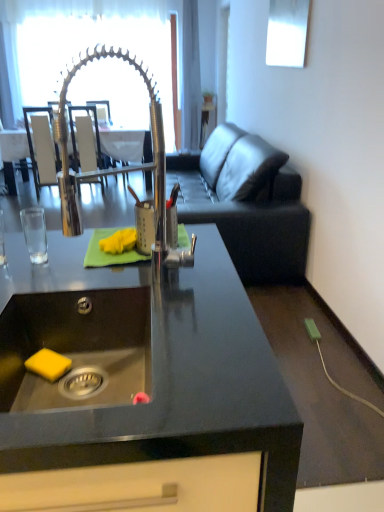
Locate an element on the screen. The image size is (384, 512). black granite countertop at center is located at coordinates (146, 374).

The width and height of the screenshot is (384, 512). In order to click on clear glass door at upper center in this screenshot , I will do `click(88, 42)`.

Describe the element at coordinates (246, 204) in the screenshot. The image size is (384, 512). I see `dark gray leather couch at right` at that location.

I want to click on black granite countertop at center, so click(146, 374).

Does wooden armchair at center, acting as the 2th armchair starting from the left, contain white leather armchair at upper left, which is the 2th armchair in right-to-left order?

No, wooden armchair at center, acting as the 2th armchair starting from the left, does not contain white leather armchair at upper left, which is the 2th armchair in right-to-left order.

Is point (89, 160) positioned before point (43, 147)?

Yes, point (89, 160) is in front of point (43, 147).

Is there a large distance between wooden armchair at center, acting as the 2th armchair starting from the left, and white leather armchair at upper left, the 1th armchair viewed from the left?

That's not correct — wooden armchair at center, acting as the 2th armchair starting from the left, is a little close to white leather armchair at upper left, the 1th armchair viewed from the left.

From their relative heights in the image, would you say wooden armchair at center, acting as the 2th armchair starting from the left, is taller or shorter than white leather armchair at upper left, the 1th armchair viewed from the left?

In the image, wooden armchair at center, acting as the 2th armchair starting from the left, appears to be shorter than white leather armchair at upper left, the 1th armchair viewed from the left.

From the image's perspective, starting from the stainless steel sink at lower left, which armchair is the 1st one above? Please provide its 2D coordinates.

[(42, 147)]

Is stainless steel sink at lower left directly adjacent to white leather armchair at upper left, which is the 2th armchair in right-to-left order?

stainless steel sink at lower left and white leather armchair at upper left, which is the 2th armchair in right-to-left order, are clearly separated.

From a real-world perspective, between stainless steel sink at lower left and white leather armchair at upper left, which is the 2th armchair in right-to-left order, who is vertically higher?

stainless steel sink at lower left is physically above.

Choose the correct answer: Is stainless steel sink at lower left inside white leather armchair at upper left, which is the 2th armchair in right-to-left order, or outside it?

stainless steel sink at lower left is located beyond the bounds of white leather armchair at upper left, which is the 2th armchair in right-to-left order.

Is polished chrome tap at center far away from clear glass door at upper center?

Indeed, polished chrome tap at center is not near clear glass door at upper center.

Between polished chrome tap at center and clear glass door at upper center, which one is positioned in front?

polished chrome tap at center is closer to the camera.

Is polished chrome tap at center positioned with its back to clear glass door at upper center?

polished chrome tap at center does not have its back to clear glass door at upper center.

Could you tell me if white leather armchair at upper left, which is the 2th armchair in right-to-left order, is turned towards wooden armchair at center, acting as the 2th armchair starting from the left?

No, white leather armchair at upper left, which is the 2th armchair in right-to-left order, is not facing towards wooden armchair at center, acting as the 2th armchair starting from the left.

Is white leather armchair at upper left, which is the 2th armchair in right-to-left order, to the left of wooden armchair at center, acting as the 2th armchair starting from the left, from the viewer's perspective?

Indeed, white leather armchair at upper left, which is the 2th armchair in right-to-left order, is positioned on the left side of wooden armchair at center, acting as the 2th armchair starting from the left.

Between white leather armchair at upper left, which is the 2th armchair in right-to-left order, and wooden armchair at center, which appears as the 1th armchair when viewed from the right, which one has smaller width?

Thinner between the two is white leather armchair at upper left, which is the 2th armchair in right-to-left order.

Is white leather armchair at upper left, which is the 2th armchair in right-to-left order, not near wooden armchair at center, which appears as the 1th armchair when viewed from the right?

white leather armchair at upper left, which is the 2th armchair in right-to-left order, is near wooden armchair at center, which appears as the 1th armchair when viewed from the right, not far away.

Is clear glass door at upper center touching white leather armchair at upper left, which is the 2th armchair in right-to-left order?

No, clear glass door at upper center is not with white leather armchair at upper left, which is the 2th armchair in right-to-left order.

From a real-world perspective, which object rests below the other?

In real-world perspective, white leather armchair at upper left, which is the 2th armchair in right-to-left order, is lower.

In the scene shown: Can we say clear glass door at upper center lies outside white leather armchair at upper left, which is the 2th armchair in right-to-left order?

Absolutely, clear glass door at upper center is external to white leather armchair at upper left, which is the 2th armchair in right-to-left order.

Between clear glass door at upper center and white leather armchair at upper left, the 1th armchair viewed from the left, which one has smaller width?

clear glass door at upper center is thinner.

From a real-world perspective, which object rests below the other?

wooden armchair at center, acting as the 2th armchair starting from the left.

Between wooden armchair at center, acting as the 2th armchair starting from the left, and polished chrome tap at center, which one is positioned in front?

polished chrome tap at center.

Considering the relative sizes of wooden armchair at center, acting as the 2th armchair starting from the left, and polished chrome tap at center in the image provided, is wooden armchair at center, acting as the 2th armchair starting from the left, smaller than polished chrome tap at center?

Incorrect, wooden armchair at center, acting as the 2th armchair starting from the left, is not smaller in size than polished chrome tap at center.

In terms of height, does wooden armchair at center, which appears as the 1th armchair when viewed from the right, look taller or shorter compared to polished chrome tap at center?

Considering their sizes, wooden armchair at center, which appears as the 1th armchair when viewed from the right, has more height than polished chrome tap at center.

Considering the points (155, 122) and (235, 265), which point is behind, point (155, 122) or point (235, 265)?

Positioned behind is point (235, 265).

Are polished chrome tap at center and dark gray leather couch at right making contact?

No, polished chrome tap at center is not beside dark gray leather couch at right.

Who is shorter, polished chrome tap at center or dark gray leather couch at right?

With less height is polished chrome tap at center.

Is polished chrome tap at center to the right of dark gray leather couch at right from the viewer's perspective?

No, polished chrome tap at center is not to the right of dark gray leather couch at right.

This screenshot has height=512, width=384. Find the location of `armchair that is on the left side of wooden armchair at center, acting as the 2th armchair starting from the left`. armchair that is on the left side of wooden armchair at center, acting as the 2th armchair starting from the left is located at coordinates click(42, 147).

Starting from the stainless steel sink at lower left, which armchair is the 1st one behind? Please provide its 2D coordinates.

[(42, 147)]

Estimate the real-world distances between objects in this image. Which object is further from dark gray leather couch at right, wooden armchair at center, acting as the 2th armchair starting from the left, or white leather armchair at upper left, the 1th armchair viewed from the left?

wooden armchair at center, acting as the 2th armchair starting from the left.

Based on their spatial positions, is clear glass door at upper center or dark gray leather couch at right further from wooden armchair at center, which appears as the 1th armchair when viewed from the right?

clear glass door at upper center.

Which object lies nearer to the anchor point polished chrome tap at center, dark gray leather couch at right or black granite countertop at center?

black granite countertop at center.

Which object lies nearer to the anchor point dark gray leather couch at right, white leather armchair at upper left, the 1th armchair viewed from the left, or polished chrome tap at center?

Based on the image, white leather armchair at upper left, the 1th armchair viewed from the left, appears to be nearer to dark gray leather couch at right.

Consider the image. Looking at the image, which one is located further to wooden armchair at center, which appears as the 1th armchair when viewed from the right, polished chrome tap at center or black granite countertop at center?

black granite countertop at center.

Estimate the real-world distances between objects in this image. Which object is further from polished chrome tap at center, clear glass door at upper center or stainless steel sink at lower left?

Among the two, clear glass door at upper center is located further to polished chrome tap at center.

Which object lies further to the anchor point black granite countertop at center, polished chrome tap at center or dark gray leather couch at right?

dark gray leather couch at right lies further to black granite countertop at center than the other object.

Based on their spatial positions, is black granite countertop at center or white leather armchair at upper left, the 1th armchair viewed from the left, further from clear glass door at upper center?

black granite countertop at center.

This screenshot has height=512, width=384. I want to click on armchair between clear glass door at upper center and white leather armchair at upper left, which is the 2th armchair in right-to-left order, in the up-down direction, so click(86, 144).

Where is `armchair located between stainless steel sink at lower left and wooden armchair at center, which appears as the 1th armchair when viewed from the right, in the depth direction`? The width and height of the screenshot is (384, 512). armchair located between stainless steel sink at lower left and wooden armchair at center, which appears as the 1th armchair when viewed from the right, in the depth direction is located at coordinates (42, 147).

Locate an element on the screen. The image size is (384, 512). tap positioned between black granite countertop at center and wooden armchair at center, which appears as the 1th armchair when viewed from the right, from near to far is located at coordinates (122, 168).

The height and width of the screenshot is (512, 384). What are the coordinates of `studio couch between stainless steel sink at lower left and wooden armchair at center, which appears as the 1th armchair when viewed from the right, along the z-axis` in the screenshot? It's located at (246, 204).